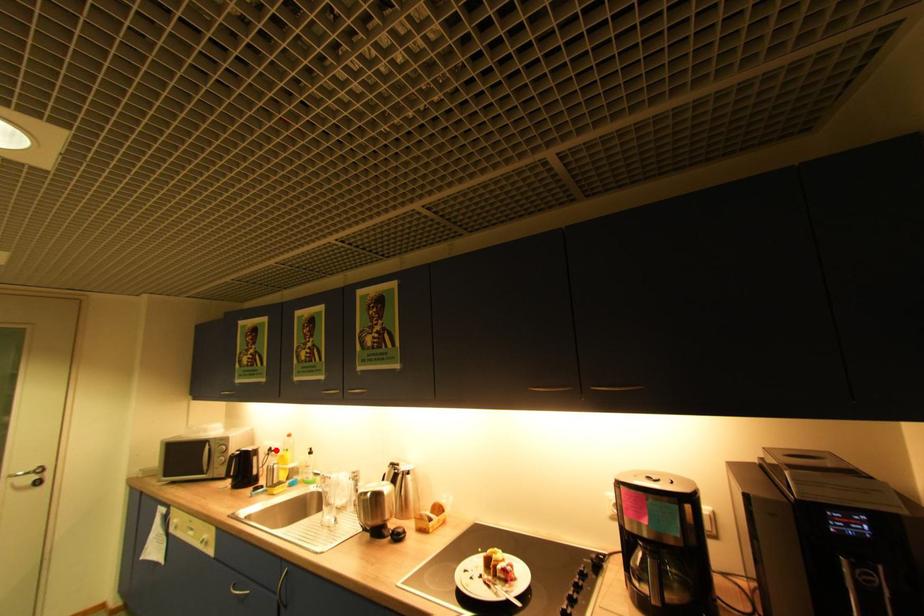
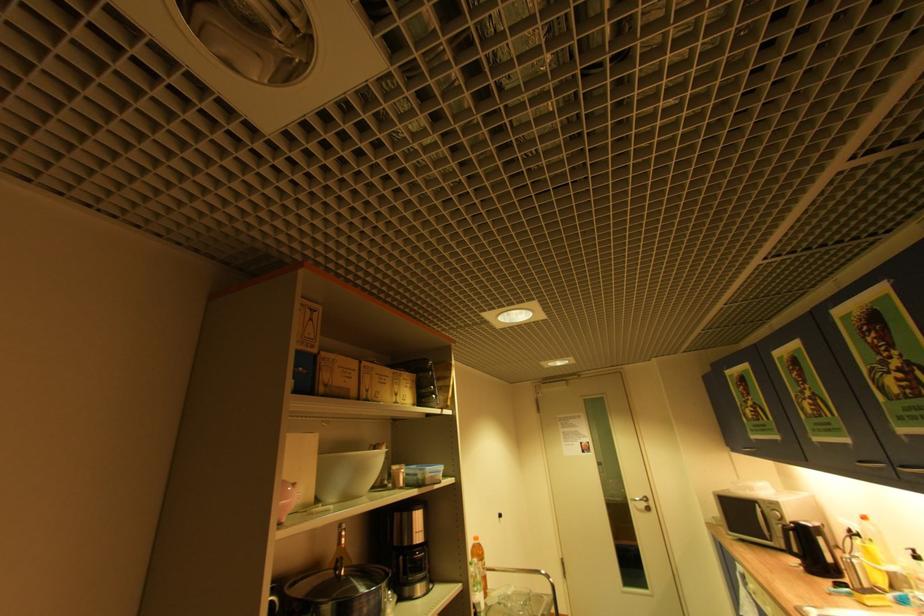
Question: I am providing you with two images of the same scene from different viewpoints. Given a red point in image1, look at the same physical point in image2. Is it:

Choices:
 (A) Closer to the viewpoint
 (B) Farther from the viewpoint

Answer: (A)